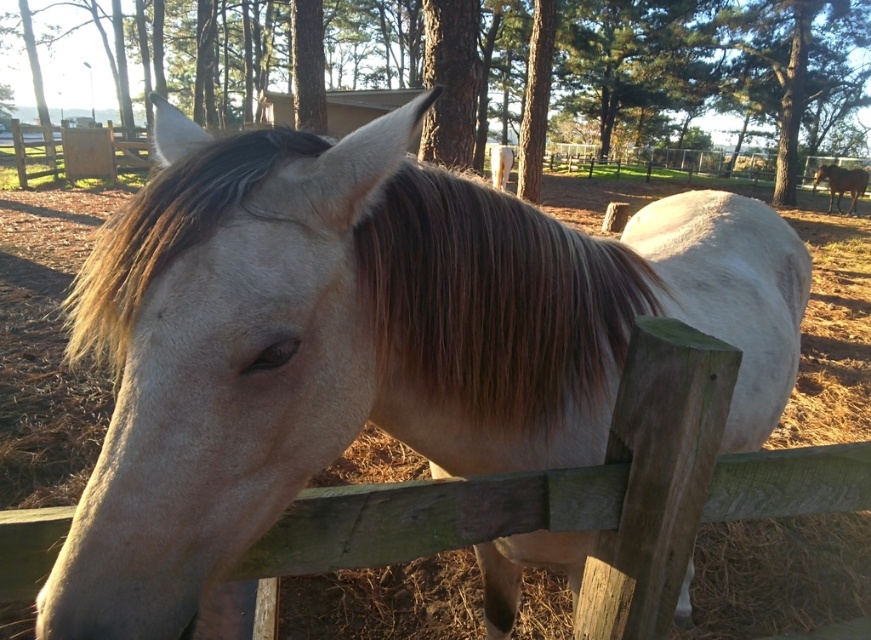
Can you confirm if brown silky mane at center is shorter than brown glossy horse at upper right?

In fact, brown silky mane at center may be taller than brown glossy horse at upper right.

Does point (431, 227) come farther from viewer compared to point (824, 173)?

No, (431, 227) is closer to viewer.

Does point (234, 147) lie behind point (849, 188)?

No, (234, 147) is closer to viewer.

Identify the location of brown silky mane at center. The image size is (871, 640). (493, 298).